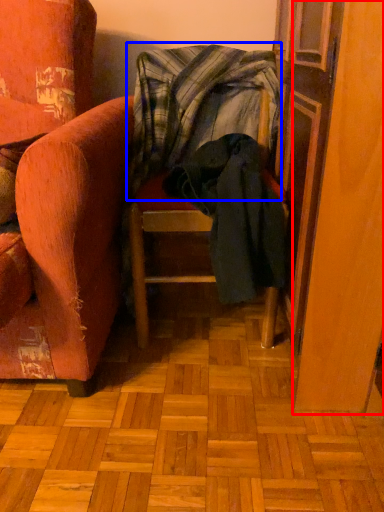
Question: Among these objects, which one is farthest to the camera, screen door (highlighted by a red box) or blanket (highlighted by a blue box)?

Choices:
 (A) screen door
 (B) blanket

Answer: (B)